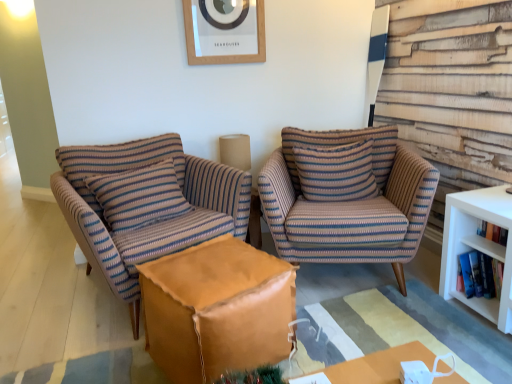
What are the coordinates of `vacant space positioned to the left of striped fabric armchair at left, marked as the second chair in a right-to-left arrangement` in the screenshot? It's located at (40, 290).